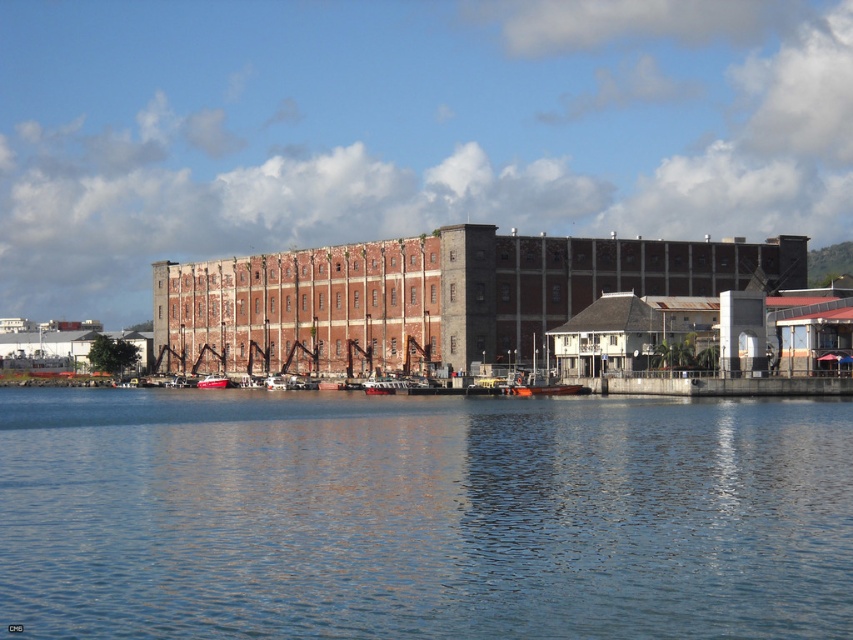
Can you confirm if blue water at center is positioned to the left of metallic red boat at center?

In fact, blue water at center is to the right of metallic red boat at center.

Does blue water at center appear under metallic red boat at center?

Yes.

Locate an element on the screen. The image size is (853, 640). blue water at center is located at coordinates point(422,515).

You are a GUI agent. You are given a task and a screenshot of the screen. Output one action in this format:
    pyautogui.click(x=<x>, y=<y>)
    Task: Click on the blue water at center
    The image size is (853, 640).
    Given the screenshot: What is the action you would take?
    pyautogui.click(x=422, y=515)